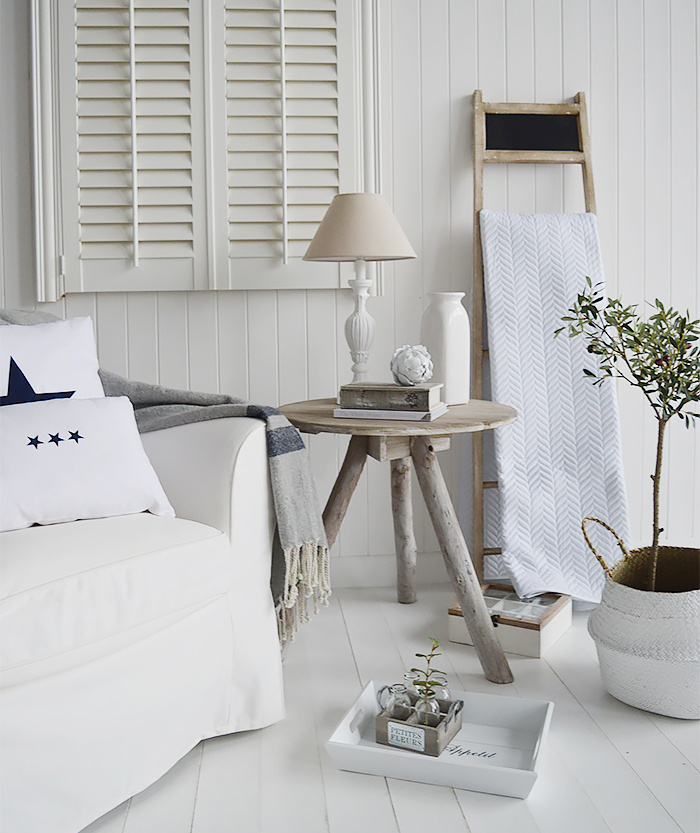
The height and width of the screenshot is (833, 700). I want to click on lamp base, so click(356, 360).